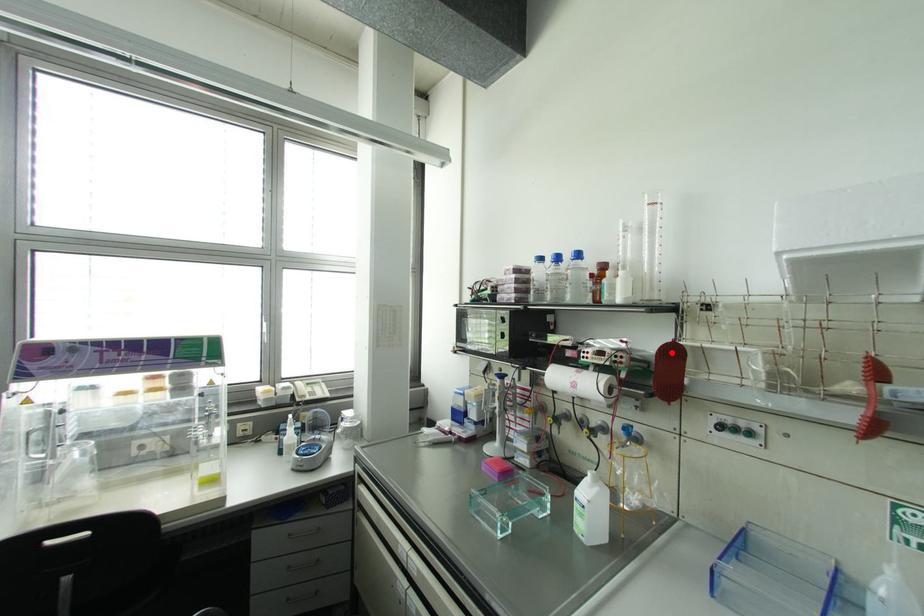
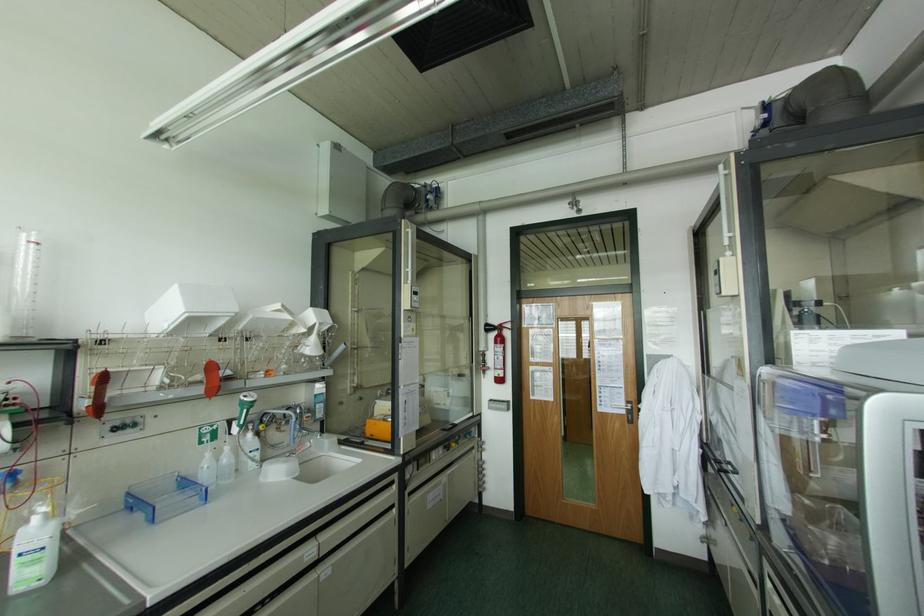
Locate, in the second image, the point that corresponds to the highlighted location in the first image.

(102, 379)